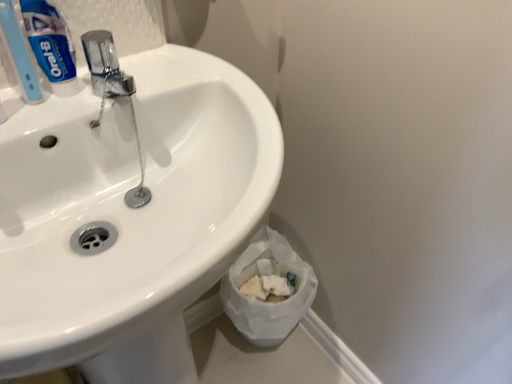
Measure the distance between point (37,86) and camera.

The distance of point (37,86) from camera is 21.57 inches.

Locate an element on the screen. This screenshot has width=512, height=384. blue glossy toothpaste at upper left is located at coordinates (51, 45).

What do you see at coordinates (264, 302) in the screenshot?
I see `white crumpled paper at lower right` at bounding box center [264, 302].

The image size is (512, 384). Find the location of `light blue plastic toothbrush at upper left`. light blue plastic toothbrush at upper left is located at coordinates (19, 54).

The height and width of the screenshot is (384, 512). In order to click on sink lying on the left of white crumpled paper at lower right in this screenshot , I will do `click(129, 215)`.

Who is shorter, white glossy sink at upper left or white crumpled paper at lower right?

With less height is white crumpled paper at lower right.

From the image's perspective, which is below, white glossy sink at upper left or white crumpled paper at lower right?

From the image's view, white crumpled paper at lower right is below.

Is white crumpled paper at lower right located within white glossy sink at upper left?

Actually, white crumpled paper at lower right is outside white glossy sink at upper left.

Identify the location of toothpaste lying behind the light blue plastic toothbrush at upper left. The width and height of the screenshot is (512, 384). (51, 45).

From the image's perspective, is blue glossy toothpaste at upper left located beneath light blue plastic toothbrush at upper left?

Yes, from the image's perspective, blue glossy toothpaste at upper left is beneath light blue plastic toothbrush at upper left.

Is blue glossy toothpaste at upper left situated inside light blue plastic toothbrush at upper left or outside?

blue glossy toothpaste at upper left is located beyond the bounds of light blue plastic toothbrush at upper left.

Is light blue plastic toothbrush at upper left completely or partially inside white glossy sink at upper left?

That's incorrect, light blue plastic toothbrush at upper left is not inside white glossy sink at upper left.

At what (x,y) coordinates should I click in order to perform the action: click on sink below the light blue plastic toothbrush at upper left (from a real-world perspective). Please return your answer as a coordinate pair (x, y). This screenshot has height=384, width=512. Looking at the image, I should click on (129, 215).

Looking at this image, how many degrees apart are the facing directions of white glossy sink at upper left and light blue plastic toothbrush at upper left?

The angular difference between white glossy sink at upper left and light blue plastic toothbrush at upper left is 3.37 degrees.

Considering the sizes of objects white glossy sink at upper left and light blue plastic toothbrush at upper left in the image provided, who is bigger, white glossy sink at upper left or light blue plastic toothbrush at upper left?

Bigger between the two is white glossy sink at upper left.

Is white glossy sink at upper left a part of white crumpled paper at lower right?

Definitely not — white glossy sink at upper left is not inside white crumpled paper at lower right.

Would you say white crumpled paper at lower right is to the left or to the right of white glossy sink at upper left in the picture?

Clearly, white crumpled paper at lower right is on the right of white glossy sink at upper left in the image.

Is white crumpled paper at lower right next to white glossy sink at upper left?

No, white crumpled paper at lower right is not beside white glossy sink at upper left.

The image size is (512, 384). What are the coordinates of `sink in front of the white crumpled paper at lower right` in the screenshot? It's located at (129, 215).

Consider the image. Which is more to the left, light blue plastic toothbrush at upper left or white glossy sink at upper left?

Positioned to the left is light blue plastic toothbrush at upper left.

Does light blue plastic toothbrush at upper left turn towards white glossy sink at upper left?

No, light blue plastic toothbrush at upper left does not turn towards white glossy sink at upper left.

The image size is (512, 384). What are the coordinates of `toothbrush above the white glossy sink at upper left (from a real-world perspective)` in the screenshot? It's located at (19, 54).

Is light blue plastic toothbrush at upper left inside or outside of white glossy sink at upper left?

light blue plastic toothbrush at upper left is not enclosed by white glossy sink at upper left.

Which is less distant, (x=30, y=29) or (x=2, y=337)?

Point (x=30, y=29) appears to be farther away from the viewer than point (x=2, y=337).

Considering the sizes of blue glossy toothpaste at upper left and white glossy sink at upper left in the image, is blue glossy toothpaste at upper left wider or thinner than white glossy sink at upper left?

blue glossy toothpaste at upper left is thinner than white glossy sink at upper left.

Looking at this image, between blue glossy toothpaste at upper left and white glossy sink at upper left, which one appears on the right side from the viewer's perspective?

Positioned to the right is white glossy sink at upper left.

From a real-world perspective, does blue glossy toothpaste at upper left sit lower than white glossy sink at upper left?

No, from a real-world perspective, blue glossy toothpaste at upper left is not beneath white glossy sink at upper left.

Looking at the image, does white glossy sink at upper left seem bigger or smaller compared to blue glossy toothpaste at upper left?

Clearly, white glossy sink at upper left is larger in size than blue glossy toothpaste at upper left.

How many degrees apart are the facing directions of white glossy sink at upper left and blue glossy toothpaste at upper left?

The angle between the facing direction of white glossy sink at upper left and the facing direction of blue glossy toothpaste at upper left is 3.37 degrees.

Considering the points (80, 337) and (44, 39), which point is in front, point (80, 337) or point (44, 39)?

The point (80, 337) is in front.

Considering the sizes of objects white glossy sink at upper left and blue glossy toothpaste at upper left in the image provided, who is thinner, white glossy sink at upper left or blue glossy toothpaste at upper left?

With smaller width is blue glossy toothpaste at upper left.

The width and height of the screenshot is (512, 384). In order to click on toilet paper on the right of white glossy sink at upper left in this screenshot , I will do `click(264, 302)`.

Locate an element on the screen. This screenshot has height=384, width=512. toothbrush lying above the blue glossy toothpaste at upper left (from the image's perspective) is located at coordinates (19, 54).

Considering their positions, is blue glossy toothpaste at upper left positioned closer to white crumpled paper at lower right than light blue plastic toothbrush at upper left?

Based on the image, blue glossy toothpaste at upper left appears to be nearer to white crumpled paper at lower right.

Which object lies nearer to the anchor point white crumpled paper at lower right, white glossy sink at upper left or light blue plastic toothbrush at upper left?

Based on the image, white glossy sink at upper left appears to be nearer to white crumpled paper at lower right.

Which object lies further to the anchor point blue glossy toothpaste at upper left, white crumpled paper at lower right or white glossy sink at upper left?

white crumpled paper at lower right is further to blue glossy toothpaste at upper left.

Looking at the image, which one is located further to light blue plastic toothbrush at upper left, blue glossy toothpaste at upper left or white glossy sink at upper left?

white glossy sink at upper left is positioned further to the anchor light blue plastic toothbrush at upper left.

From the picture: Looking at the image, which one is located further to light blue plastic toothbrush at upper left, blue glossy toothpaste at upper left or white crumpled paper at lower right?

white crumpled paper at lower right is positioned further to the anchor light blue plastic toothbrush at upper left.

Considering their positions, is white crumpled paper at lower right positioned closer to white glossy sink at upper left than blue glossy toothpaste at upper left?

The object closer to white glossy sink at upper left is blue glossy toothpaste at upper left.

Based on their spatial positions, is white glossy sink at upper left or white crumpled paper at lower right closer to light blue plastic toothbrush at upper left?

white glossy sink at upper left is closer to light blue plastic toothbrush at upper left.

Considering their positions, is white crumpled paper at lower right positioned further to light blue plastic toothbrush at upper left than white glossy sink at upper left?

The object further to light blue plastic toothbrush at upper left is white crumpled paper at lower right.

Locate an element on the screen. toothpaste positioned between white glossy sink at upper left and white crumpled paper at lower right from near to far is located at coordinates (51, 45).

The image size is (512, 384). What are the coordinates of `toothbrush located between white glossy sink at upper left and white crumpled paper at lower right in the depth direction` in the screenshot? It's located at (19, 54).

In order to click on toothpaste between light blue plastic toothbrush at upper left and white glossy sink at upper left in the vertical direction in this screenshot , I will do pyautogui.click(x=51, y=45).

This screenshot has width=512, height=384. What are the coordinates of `toothpaste located between light blue plastic toothbrush at upper left and white crumpled paper at lower right in the depth direction` in the screenshot? It's located at (51, 45).